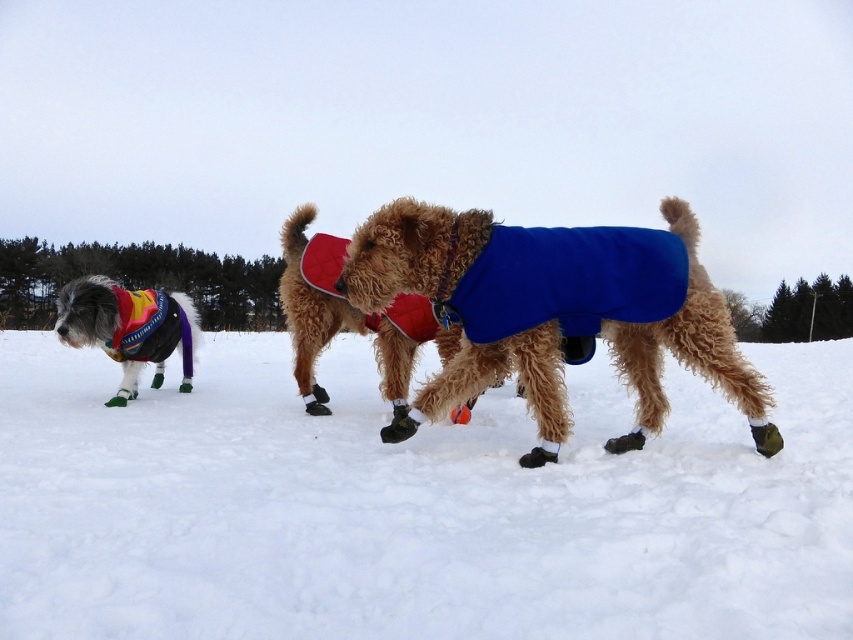
Who is shorter, white fluffy snow at center or blue fleece coat at center?

Standing shorter between the two is white fluffy snow at center.

Which is more to the left, white fluffy snow at center or blue fleece coat at center?

white fluffy snow at center

Is point (287, 454) positioned behind point (669, 228)?

No, (287, 454) is in front of (669, 228).

Locate an element on the screen. The height and width of the screenshot is (640, 853). white fluffy snow at center is located at coordinates (413, 506).

Is blue fleece coat at center smaller than multicolored knitted sweater at left?

Actually, blue fleece coat at center might be larger than multicolored knitted sweater at left.

Who is more forward, (527, 243) or (148, 349)?

Point (527, 243)

Is point (541, 424) positioned in front of point (122, 378)?

That is True.

Find the location of a particular element. blue fleece coat at center is located at coordinates (554, 310).

Which is more to the right, white fluffy snow at center or multicolored knitted sweater at left?

Positioned to the right is white fluffy snow at center.

Is point (766, 589) farther from camera compared to point (90, 336)?

No, it is in front of (90, 336).

Is point (169, 620) farther from camera compared to point (163, 324)?

No, (169, 620) is closer to viewer.

The image size is (853, 640). In order to click on white fluffy snow at center in this screenshot , I will do `click(413, 506)`.